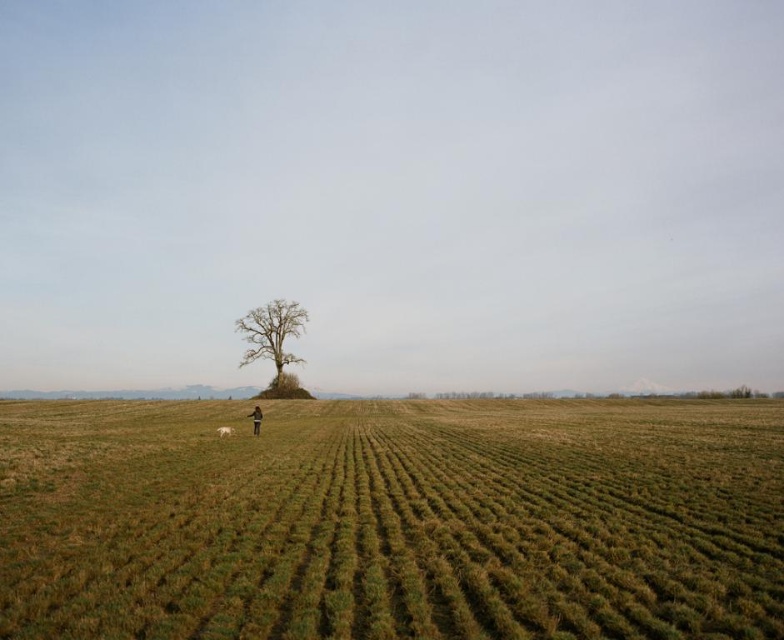
Who is taller, bare wood tree at center or white fur dog at lower center?

bare wood tree at center is taller.

Is point (256, 346) less distant than point (220, 428)?

No, (256, 346) is further to viewer.

The height and width of the screenshot is (640, 784). I want to click on bare wood tree at center, so click(271, 332).

Does bare wood tree at center appear under dark brown leather jacket at lower center?

Actually, bare wood tree at center is above dark brown leather jacket at lower center.

Can you confirm if bare wood tree at center is positioned to the left of dark brown leather jacket at lower center?

Indeed, bare wood tree at center is positioned on the left side of dark brown leather jacket at lower center.

This screenshot has width=784, height=640. Find the location of `bare wood tree at center`. bare wood tree at center is located at coordinates (271, 332).

Between point (109, 536) and point (240, 323), which one is positioned in front?

Point (109, 536) is in front.

Is green grassy field at center taller than bare wood tree at center?

In fact, green grassy field at center may be shorter than bare wood tree at center.

Does point (46, 634) come farther from viewer compared to point (300, 312)?

No.

The image size is (784, 640). Find the location of `green grassy field at center`. green grassy field at center is located at coordinates tap(392, 518).